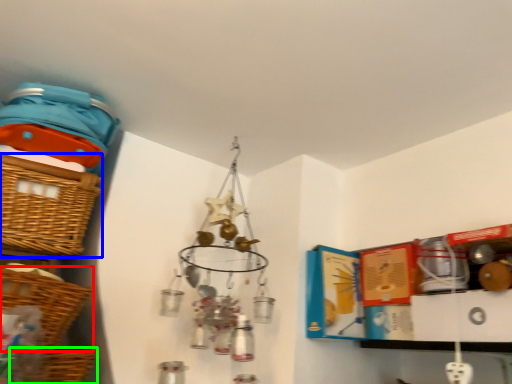
Question: Estimate the real-world distances between objects in this image. Which object is closer to basket (highlighted by a red box), basket (highlighted by a blue box) or basket (highlighted by a green box)?

Choices:
 (A) basket
 (B) basket

Answer: (B)